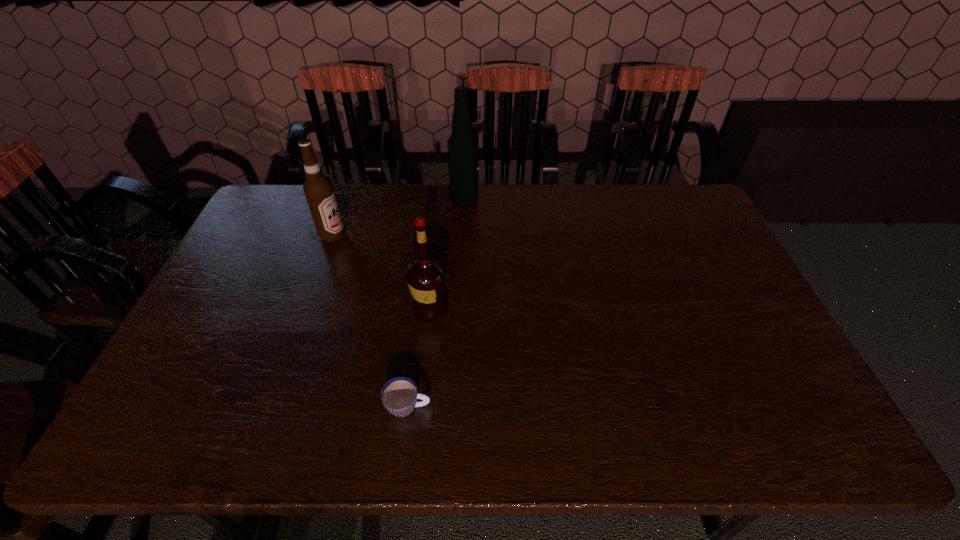
This screenshot has width=960, height=540. What are the coordinates of `free space located on the side of the nearest object with the handle` in the screenshot? It's located at (588, 407).

Find the location of a particular element. The width and height of the screenshot is (960, 540). object at the far edge is located at coordinates (463, 147).

Identify the location of object that is at the near edge. (399, 395).

You are a GUI agent. You are given a task and a screenshot of the screen. Output one action in this format:
    pyautogui.click(x=<x>, y=<y>)
    Task: Click on the vacant space at the far edge of the desktop
    Image resolution: width=960 pixels, height=540 pixels.
    Given the screenshot: What is the action you would take?
    pyautogui.click(x=451, y=215)

The width and height of the screenshot is (960, 540). In the image, there is a desktop. In order to click on blank space at the near edge in this screenshot , I will do [x=614, y=417].

The image size is (960, 540). What are the coordinates of `free space at the left edge` in the screenshot? It's located at (244, 233).

The image size is (960, 540). In the image, there is a desktop. Find the location of `free space at the right edge`. free space at the right edge is located at coordinates (723, 337).

The width and height of the screenshot is (960, 540). Identify the location of vacant space at the near left corner of the desktop. (186, 444).

I want to click on vacant area at the far right corner, so click(x=670, y=199).

The width and height of the screenshot is (960, 540). Find the location of `vacant area that lies between the leftmost object and the cup`. vacant area that lies between the leftmost object and the cup is located at coordinates (371, 321).